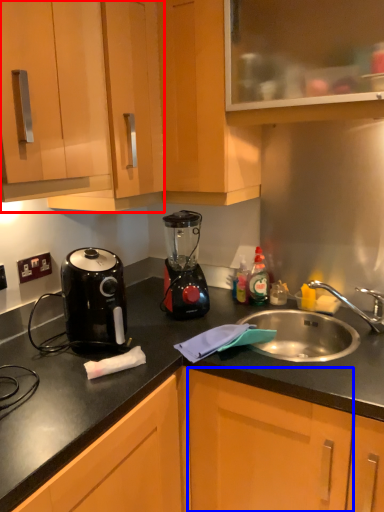
Question: Which object is further to the camera taking this photo, cabinetry (highlighted by a red box) or cabinetry (highlighted by a blue box)?

Choices:
 (A) cabinetry
 (B) cabinetry

Answer: (A)